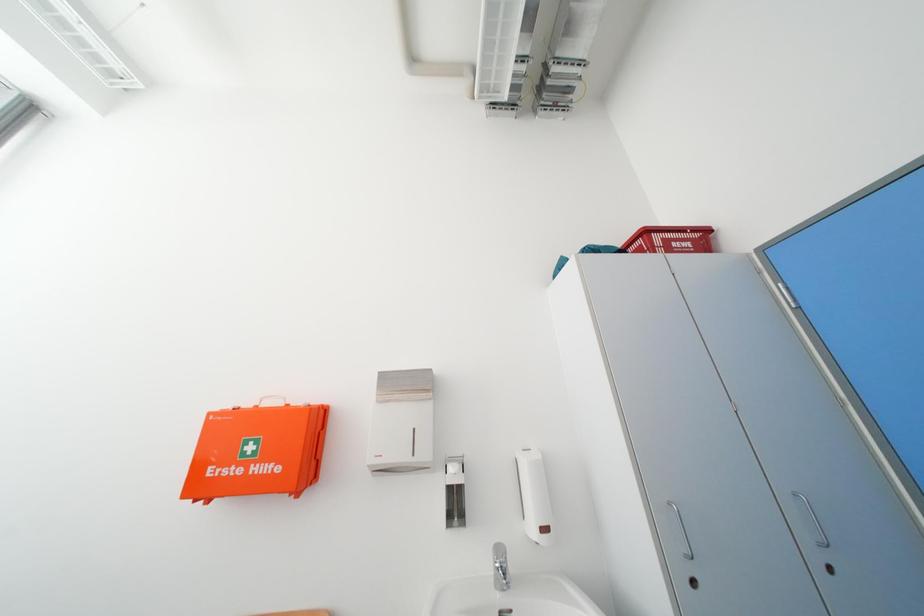
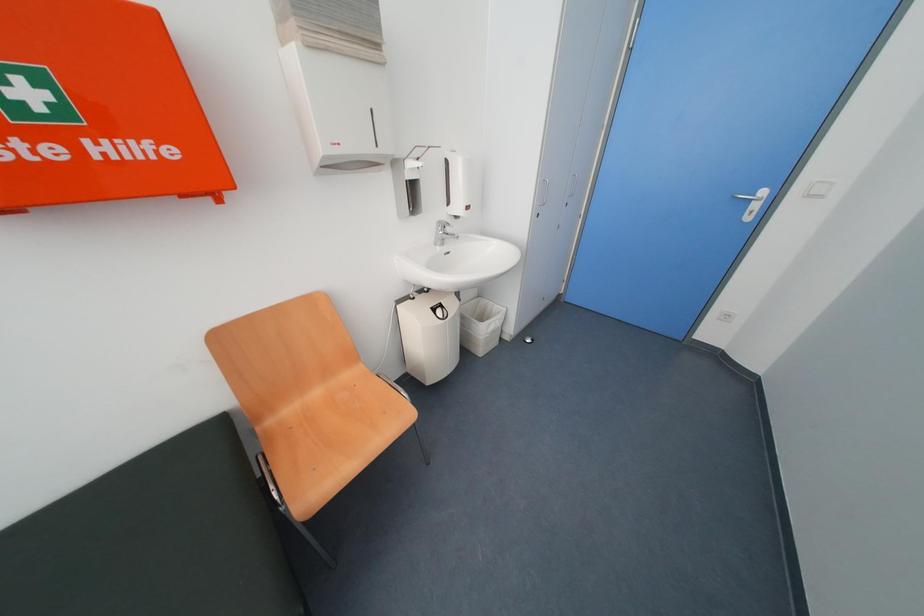
Based on the continuous images, in which direction is the camera rotating?

The camera's rotation is toward right-down.